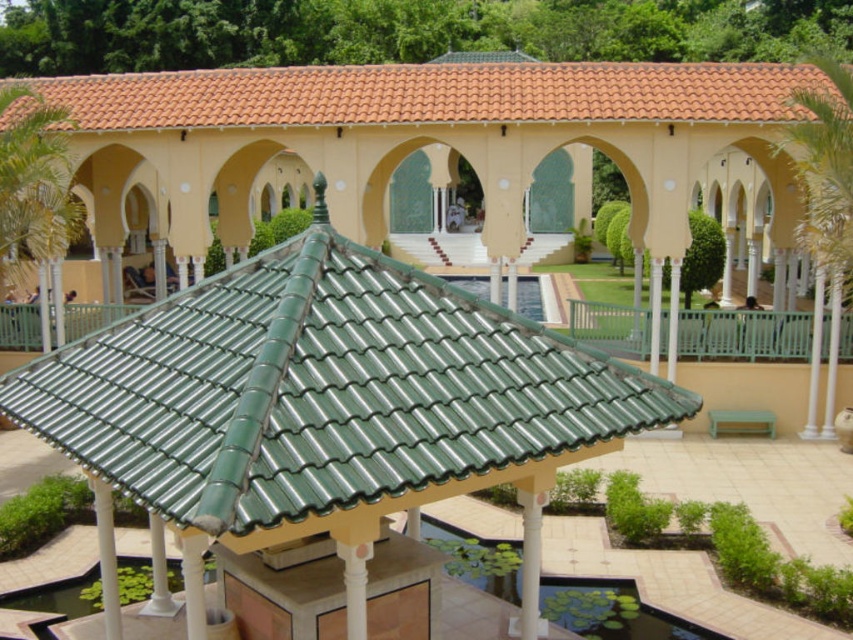
Question: Is green tile gazebo at center above orange clay tiles at upper center?

Choices:
 (A) yes
 (B) no

Answer: (B)

Question: Which of the following is the closest to the observer?

Choices:
 (A) (537, 419)
 (B) (207, 77)

Answer: (A)

Question: Does green tile gazebo at center appear on the right side of orange clay tiles at upper center?

Choices:
 (A) yes
 (B) no

Answer: (B)

Question: Which point is farther to the camera?

Choices:
 (A) (323, 477)
 (B) (344, 100)

Answer: (B)

Question: Does green tile gazebo at center have a greater width compared to orange clay tiles at upper center?

Choices:
 (A) yes
 (B) no

Answer: (B)